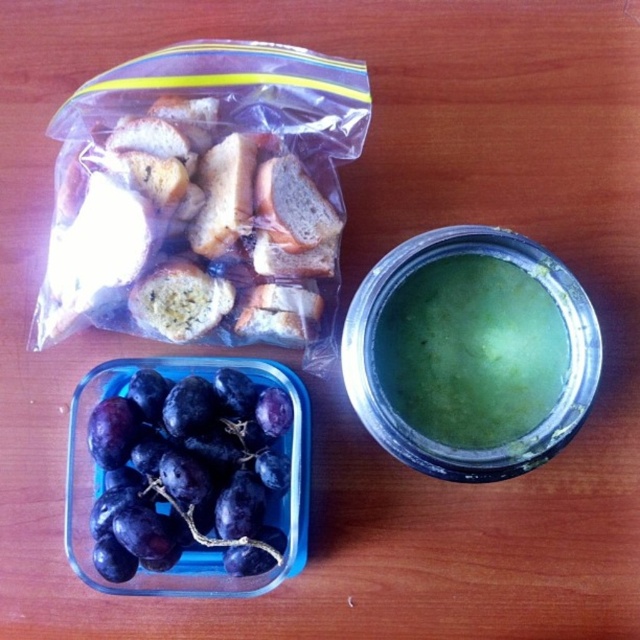
Does purple matte grapes at lower left have a greater width compared to green matte soup at upper right?

Yes, purple matte grapes at lower left is wider than green matte soup at upper right.

Does purple matte grapes at lower left have a lesser height compared to green matte soup at upper right?

No, purple matte grapes at lower left is not shorter than green matte soup at upper right.

The width and height of the screenshot is (640, 640). Find the location of `purple matte grapes at lower left`. purple matte grapes at lower left is located at coordinates (188, 472).